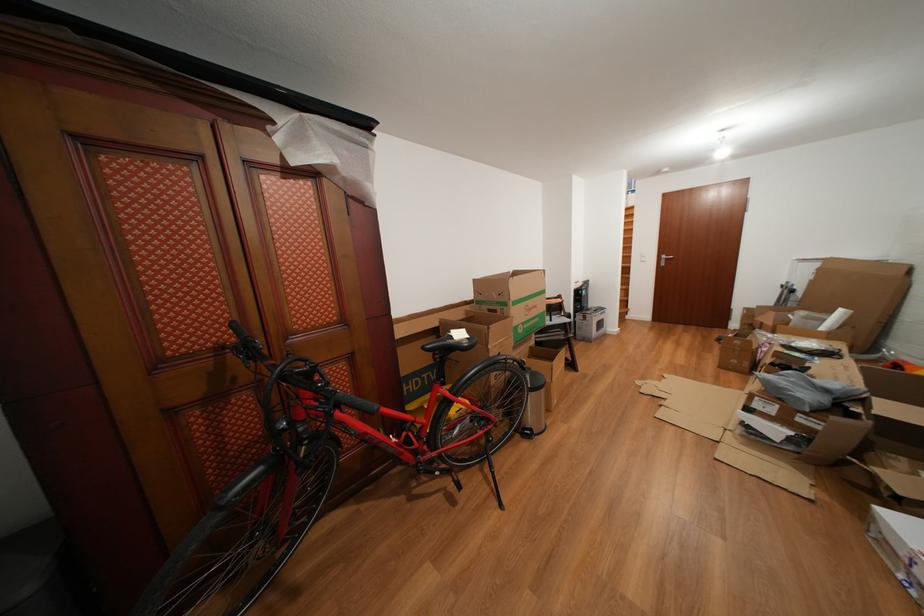
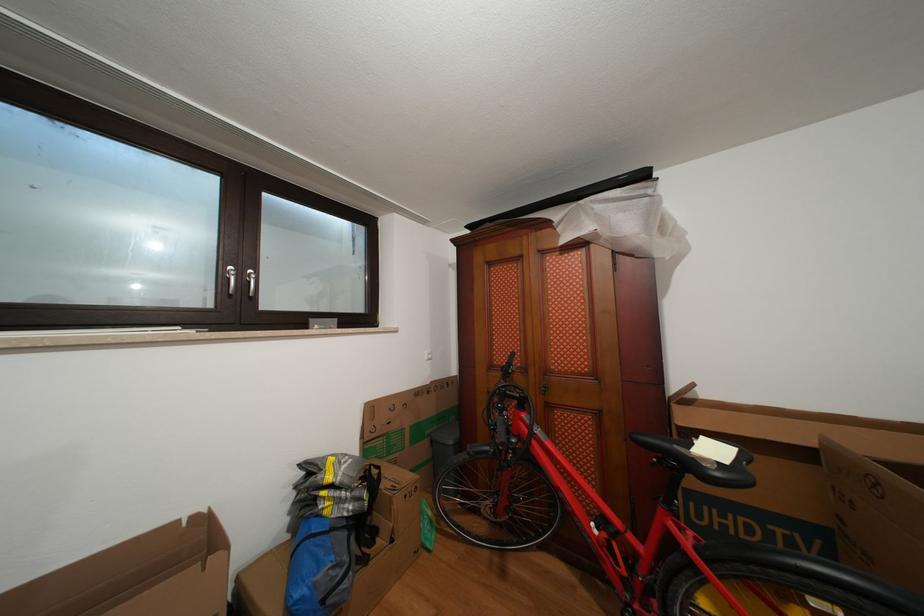
Question: The camera is either moving clockwise (left) or counter-clockwise (right) around the object. The first image is from the beginning of the video and the second image is from the end. Is the camera moving left or right when shooting the video?

Choices:
 (A) Left
 (B) Right

Answer: (B)